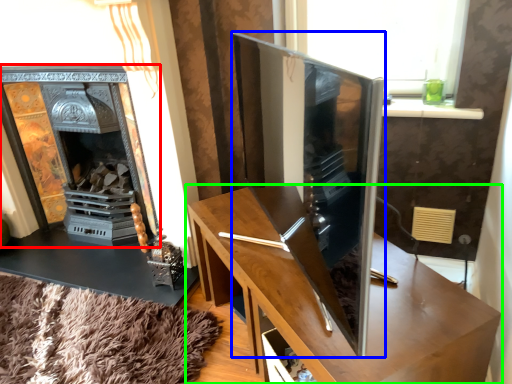
Question: Which is nearer to the fireplace (highlighted by a red box)? tv cabinet (highlighted by a blue box) or table (highlighted by a green box).

Choices:
 (A) tv cabinet
 (B) table

Answer: (B)